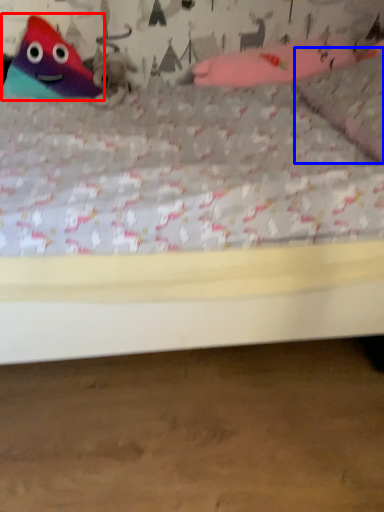
Question: Which object is closer to the camera taking this photo, toy (highlighted by a red box) or pillow (highlighted by a blue box)?

Choices:
 (A) toy
 (B) pillow

Answer: (B)